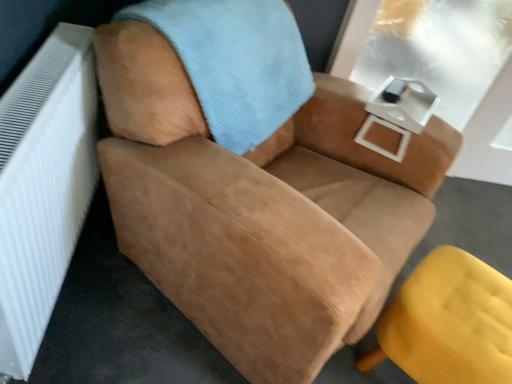
I want to click on free space above white textured radiator at left (from a real-world perspective), so click(x=40, y=82).